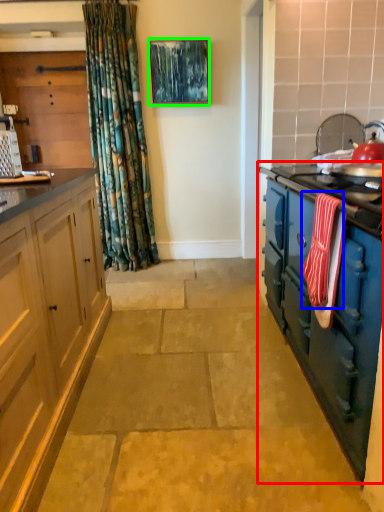
Question: Based on their relative distances, which object is nearer to cabinetry (highlighted by a red box)? Choose from material (highlighted by a blue box) and picture frame (highlighted by a green box).

Choices:
 (A) material
 (B) picture frame

Answer: (A)